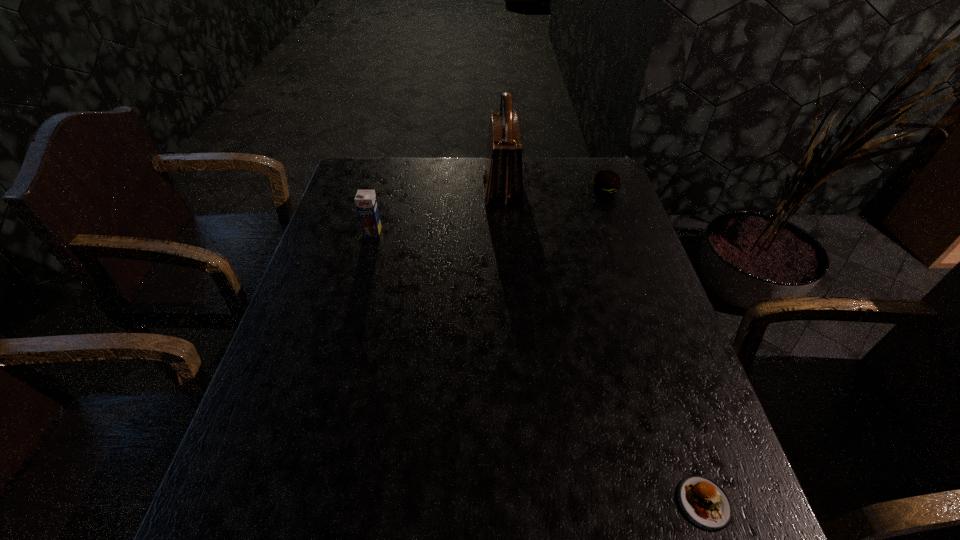
This screenshot has width=960, height=540. I want to click on unoccupied area between the third tallest object and the second tallest object, so click(489, 212).

Where is `free spot between the shorter patty (food) and the third farthest object`? This screenshot has width=960, height=540. free spot between the shorter patty (food) and the third farthest object is located at coordinates (539, 367).

Locate an element on the screen. unoccupied area between the shortest object and the third object from right to left is located at coordinates (603, 346).

Locate which object is the closest to the nearer patty (food). Please provide its 2D coordinates. Your answer should be formatted as a tuple, i.e. [(x, y)], where the tuple contains the x and y coordinates of a point satisfying the conditions above.

[(503, 180)]

Choose which object is the third nearest neighbor to the shortest object. Please provide its 2D coordinates. Your answer should be formatted as a tuple, i.e. [(x, y)], where the tuple contains the x and y coordinates of a point satisfying the conditions above.

[(366, 203)]

You are a GUI agent. You are given a task and a screenshot of the screen. Output one action in this format:
    pyautogui.click(x=<x>, y=<y>)
    Task: Click on the free space that satisfies the following two spatial constraints: 1. on the front label of the shortest object; 2. on the left side of the chocolate milk
    This screenshot has height=540, width=960.
    Given the screenshot: What is the action you would take?
    pyautogui.click(x=300, y=503)

Find the location of `vacant point that satisfies the following two spatial constraints: 1. on the front flap of the shoulder bag; 2. on the back side of the nearer patty (food)`. vacant point that satisfies the following two spatial constraints: 1. on the front flap of the shoulder bag; 2. on the back side of the nearer patty (food) is located at coordinates (522, 503).

This screenshot has height=540, width=960. Find the location of `vacant region that satisfies the following two spatial constraints: 1. on the front flap of the shortest object; 2. on the left side of the second object from left to right`. vacant region that satisfies the following two spatial constraints: 1. on the front flap of the shortest object; 2. on the left side of the second object from left to right is located at coordinates (522, 503).

Where is `free location that satisfies the following two spatial constraints: 1. on the front flap of the tallest object; 2. on the front label of the leftmost object`? Image resolution: width=960 pixels, height=540 pixels. free location that satisfies the following two spatial constraints: 1. on the front flap of the tallest object; 2. on the front label of the leftmost object is located at coordinates (505, 232).

Locate an element on the screen. The width and height of the screenshot is (960, 540). free space that satisfies the following two spatial constraints: 1. on the front flap of the nearer patty (food); 2. on the left side of the tallest object is located at coordinates (522, 503).